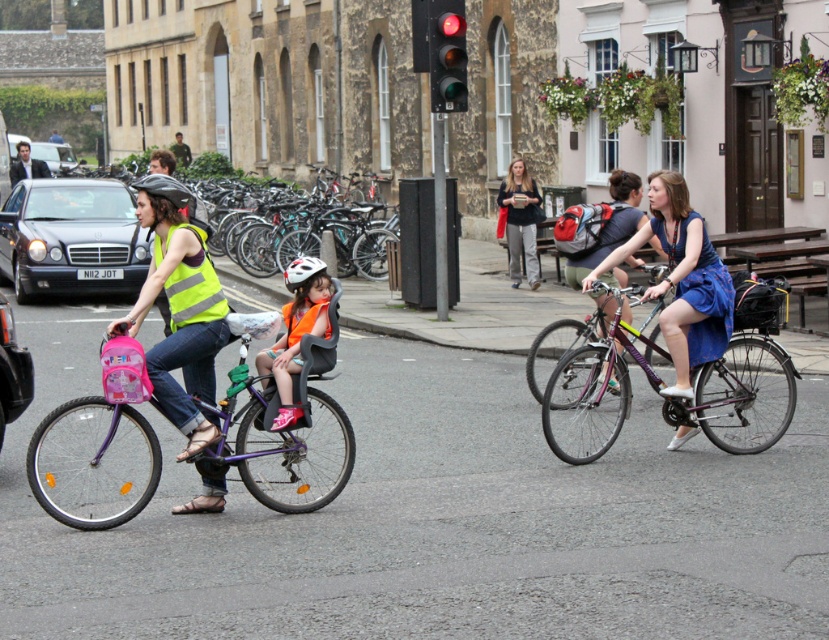
Question: Which object is positioned closest to the white matte bicycle helmet at center?

Choices:
 (A) matte gray backpack at center
 (B) reflective yellow vest at left
 (C) orange fabric helmet at center

Answer: (B)

Question: Does reflective yellow vest at left appear on the right side of blue satin dress at center?

Choices:
 (A) no
 (B) yes

Answer: (A)

Question: Is shiny purple bicycle at center to the right of red glass traffic light at upper center from the viewer's perspective?

Choices:
 (A) no
 (B) yes

Answer: (B)

Question: Where is red glass traffic light at upper center located in relation to matte gray backpack at center in the image?

Choices:
 (A) below
 (B) above

Answer: (B)

Question: Which point is farther to the camera?

Choices:
 (A) blue satin dress at center
 (B) purple matte bicycle at left
 (C) white matte bicycle helmet at center

Answer: (A)

Question: Among these objects, which one is farthest from the camera?

Choices:
 (A) purple matte bicycle at left
 (B) shiny black helmet at left
 (C) high-visibility yellow safety vest at left
 (D) shiny purple bicycle at center

Answer: (D)